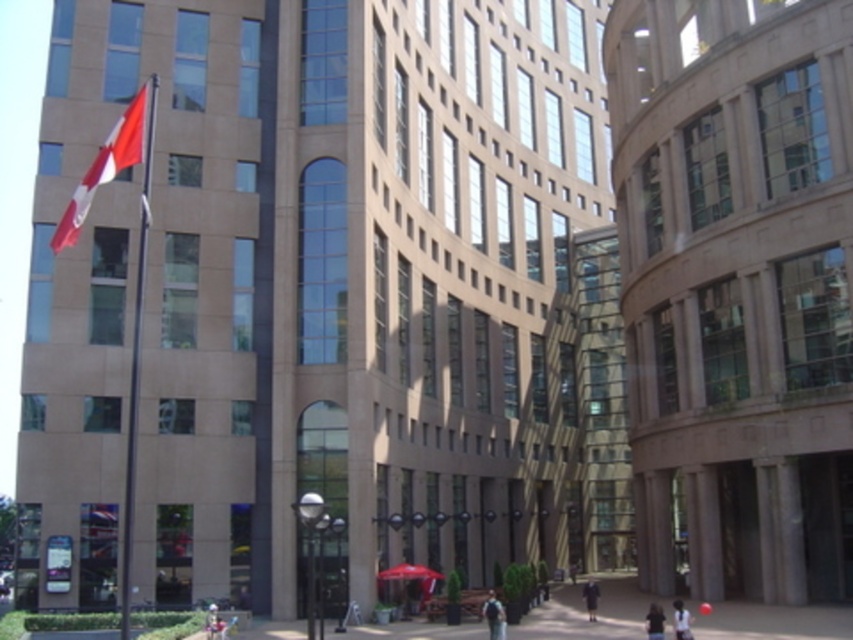
You are standing in front of the large multi story building with a dark blue backpack at center and a dark gray coat at center. Which item is nearer to you?

The dark blue backpack at center is closer to the viewer than the dark gray coat at center.

You are standing in front of a large building and see the red fabric flag at upper left and the dark blue backpack at center. Which object is positioned higher in the scene?

The red fabric flag at upper left is located above the dark blue backpack at center, so it is positioned higher in the scene.